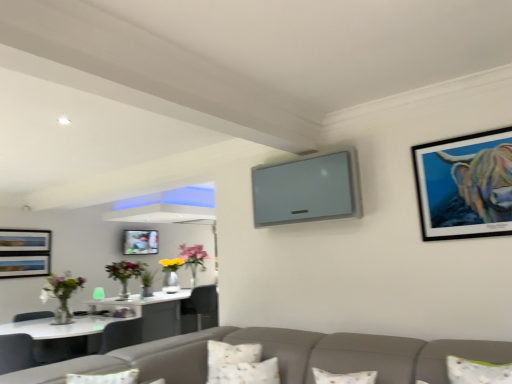
Question: From a real-world perspective, is white textured pillow at lower center, the 1th pillow positioned from the back, positioned over metallic silver picture frame at center, placed as the second picture frame when sorted from top to bottom, based on gravity?

Choices:
 (A) no
 (B) yes

Answer: (A)

Question: Is white textured pillow at lower center, the 2th pillow in the front-to-back sequence, bigger than metallic silver picture frame at center, the first picture frame positioned from the back?

Choices:
 (A) yes
 (B) no

Answer: (A)

Question: Are white textured pillow at lower center, the 1th pillow positioned from the back, and metallic silver picture frame at center, the first picture frame positioned from the back, located far from each other?

Choices:
 (A) no
 (B) yes

Answer: (B)

Question: Is white textured pillow at lower center, the 2th pillow in the front-to-back sequence, positioned beyond the bounds of metallic silver picture frame at center, which ranks as the 1th picture frame in left-to-right order?

Choices:
 (A) yes
 (B) no

Answer: (A)

Question: Does white textured pillow at lower center, the 1th pillow positioned from the back, touch metallic silver picture frame at center, the first picture frame positioned from the back?

Choices:
 (A) yes
 (B) no

Answer: (B)

Question: Considering the relative sizes of white textured pillow at lower center, the 2th pillow in the front-to-back sequence, and metallic silver picture frame at center, positioned as the 2th picture frame in front-to-back order, in the image provided, is white textured pillow at lower center, the 2th pillow in the front-to-back sequence, shorter than metallic silver picture frame at center, positioned as the 2th picture frame in front-to-back order,?

Choices:
 (A) yes
 (B) no

Answer: (A)

Question: Is metallic silver picture frame at center, the first picture frame positioned from the back, behind metallic black frame at upper right, the second picture frame in the left-to-right sequence?

Choices:
 (A) no
 (B) yes

Answer: (B)

Question: Can you confirm if metallic silver picture frame at center, placed as the second picture frame when sorted from top to bottom, is shorter than metallic black frame at upper right, the second picture frame in the left-to-right sequence?

Choices:
 (A) yes
 (B) no

Answer: (A)

Question: From a real-world perspective, is metallic silver picture frame at center, the first picture frame positioned from the back, physically below metallic black frame at upper right, which is the first picture frame from top to bottom?

Choices:
 (A) no
 (B) yes

Answer: (B)

Question: Considering the relative sizes of metallic silver picture frame at center, which ranks as the 1th picture frame in left-to-right order, and metallic black frame at upper right, which is the first picture frame from top to bottom, in the image provided, is metallic silver picture frame at center, which ranks as the 1th picture frame in left-to-right order, taller than metallic black frame at upper right, which is the first picture frame from top to bottom,?

Choices:
 (A) no
 (B) yes

Answer: (A)

Question: From the image's perspective, is metallic silver picture frame at center, which ranks as the 1th picture frame in left-to-right order, beneath metallic black frame at upper right, which is the first picture frame from right to left?

Choices:
 (A) yes
 (B) no

Answer: (A)

Question: Is metallic silver picture frame at center, the first picture frame positioned from the back, to the left of metallic black frame at upper right, the 2th picture frame in the bottom-to-top sequence, from the viewer's perspective?

Choices:
 (A) no
 (B) yes

Answer: (B)

Question: Is the position of metallic black frame at upper right, which is the first picture frame from right to left, less distant than that of metallic silver picture frame at center, which ranks as the 1th picture frame in left-to-right order?

Choices:
 (A) yes
 (B) no

Answer: (A)